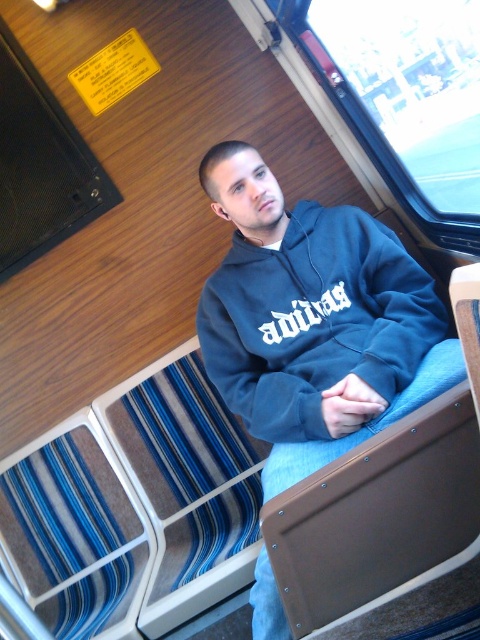
Question: Which of the following is the closest to the observer?

Choices:
 (A) dark blue hoodie at center
 (B) dark blue fleece sweatshirt at center

Answer: (A)

Question: Which object is closer to the camera taking this photo?

Choices:
 (A) dark blue hoodie at center
 (B) dark blue fleece sweatshirt at center

Answer: (A)

Question: Does dark blue hoodie at center have a smaller size compared to dark blue fleece sweatshirt at center?

Choices:
 (A) yes
 (B) no

Answer: (B)

Question: Can you confirm if dark blue hoodie at center is positioned above dark blue fleece sweatshirt at center?

Choices:
 (A) yes
 (B) no

Answer: (B)

Question: Can you confirm if dark blue hoodie at center is wider than dark blue fleece sweatshirt at center?

Choices:
 (A) no
 (B) yes

Answer: (B)

Question: Which of the following is the farthest from the observer?

Choices:
 (A) dark blue hoodie at center
 (B) dark blue fleece sweatshirt at center

Answer: (B)